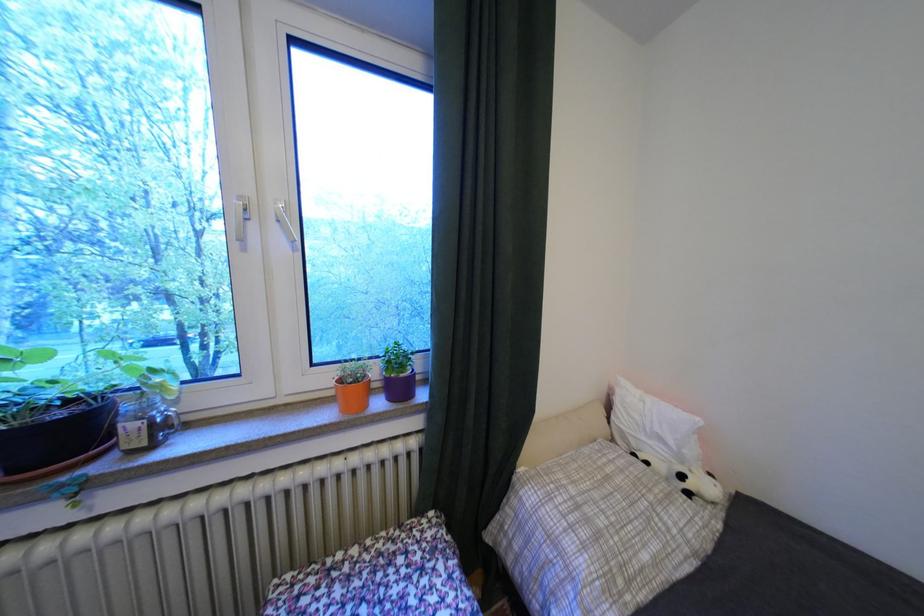
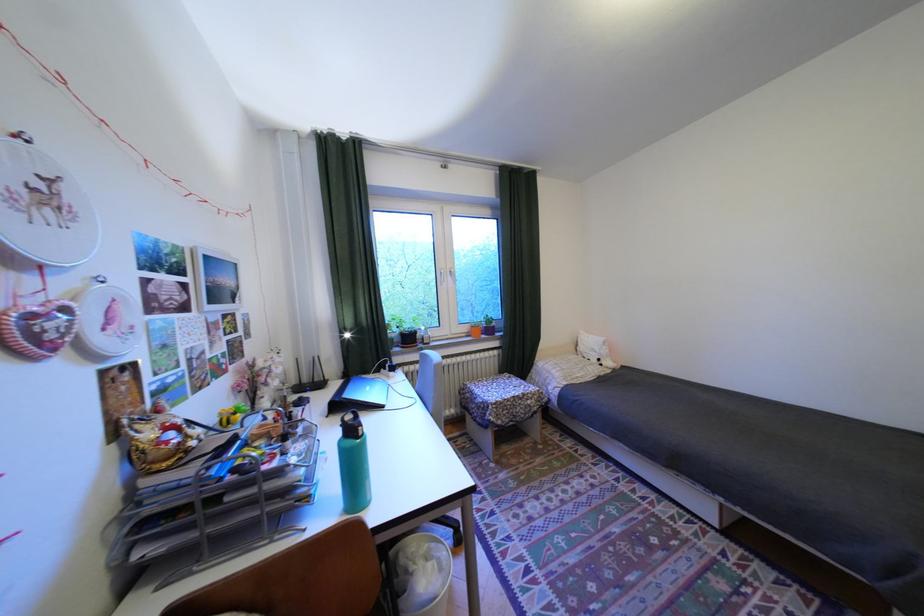
Find the pixel in the second image that matches (x=694, y=477) in the first image.

(611, 360)